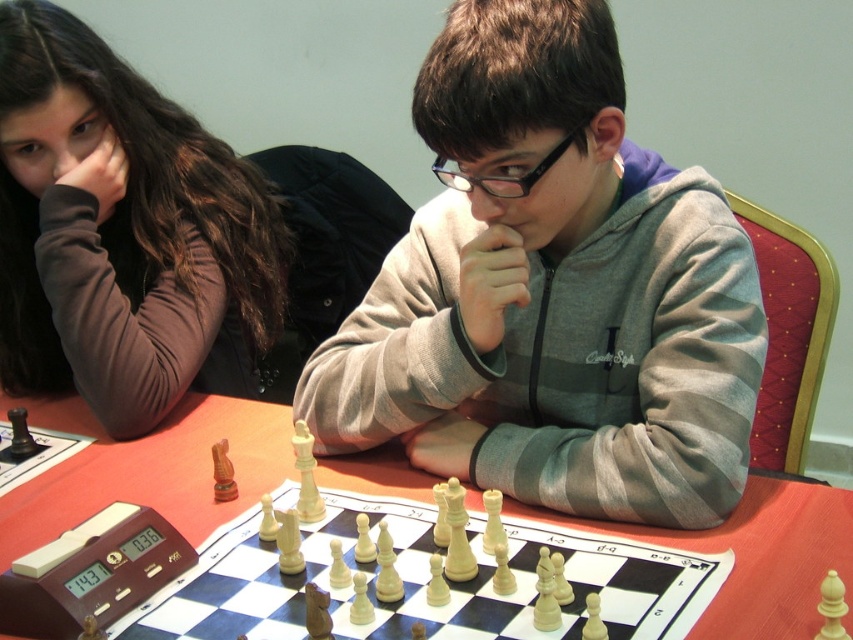
Question: Among these points, which one is nearest to the camera?

Choices:
 (A) (410, 557)
 (B) (41, 410)

Answer: (A)

Question: Based on their relative distances, which object is farther from the gray fleece hoodie at center?

Choices:
 (A) white wooden chessboard at center
 (B) wooden chessboard at center

Answer: (A)

Question: Is gray fleece hoodie at center wider than matte brown hair at upper left?

Choices:
 (A) no
 (B) yes

Answer: (B)

Question: Which of the following is the closest to the observer?

Choices:
 (A) (256, 205)
 (B) (236, 500)
 (C) (207, 598)

Answer: (C)

Question: Considering the relative positions of gray fleece hoodie at center and wooden chessboard at center in the image provided, where is gray fleece hoodie at center located with respect to wooden chessboard at center?

Choices:
 (A) above
 (B) below

Answer: (A)

Question: Can you confirm if gray fleece hoodie at center is thinner than wooden chessboard at center?

Choices:
 (A) yes
 (B) no

Answer: (A)